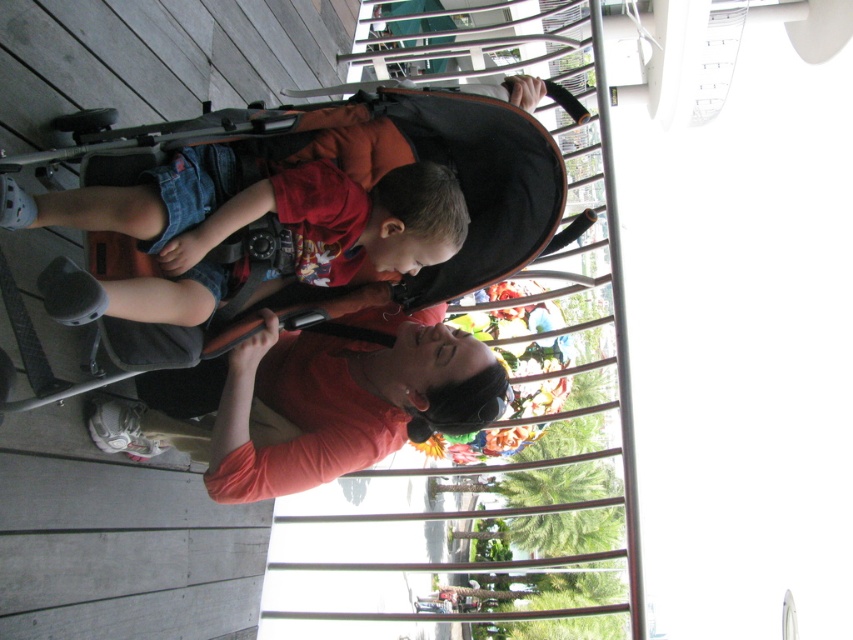
Based on the scene description, what are the coordinates of the black fabric stroller at center?

The coordinates of the black fabric stroller at center are at point (306, 209).

You are standing at the point with coordinates (306, 209) in the image. What object is located exactly at this point?

The black fabric stroller at center is located exactly at the point with coordinates (306, 209).